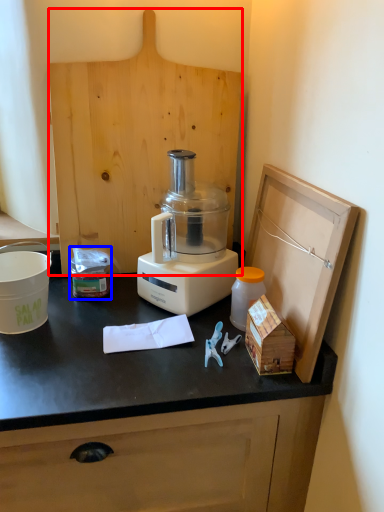
Question: Which point is closer to the camera, wood (highlighted by a red box) or waste (highlighted by a blue box)?

Choices:
 (A) wood
 (B) waste

Answer: (A)